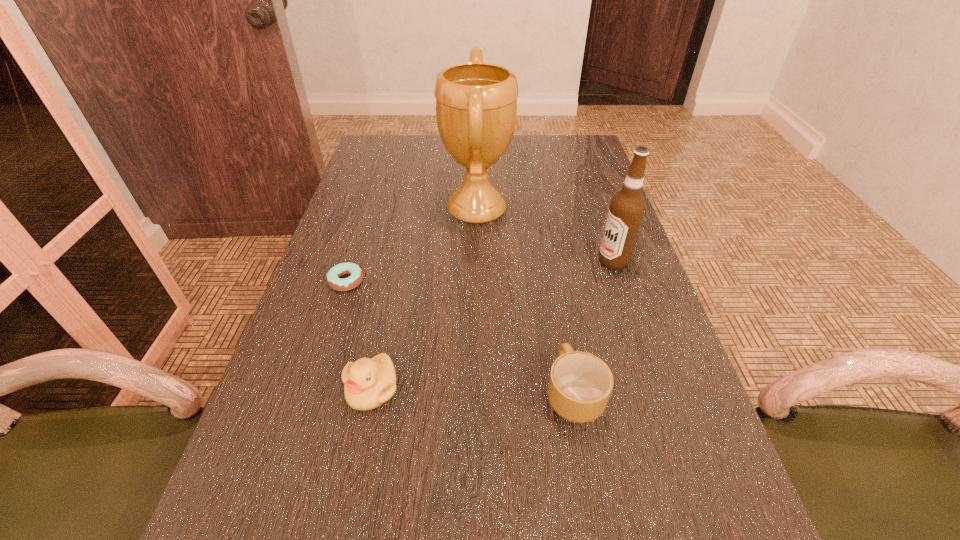
At what (x,y) coordinates should I click in order to perform the action: click on vacant area that lies between the alcohol and the tallest object. Please return your answer as a coordinate pair (x, y). The height and width of the screenshot is (540, 960). Looking at the image, I should click on (545, 235).

I want to click on free space between the duckling and the rightmost object, so click(492, 325).

This screenshot has height=540, width=960. Find the location of `free space that is in between the doughnut and the third object from left to right`. free space that is in between the doughnut and the third object from left to right is located at coordinates (412, 245).

You are a GUI agent. You are given a task and a screenshot of the screen. Output one action in this format:
    pyautogui.click(x=<x>, y=<y>)
    Task: Click on the free space between the tallest object and the doughnut
    
    Given the screenshot: What is the action you would take?
    pyautogui.click(x=412, y=245)

Identify the location of free space between the rightmost object and the second object from right to left. (593, 327).

Locate which object ranks third in proximity to the fourth object from right to left. Please provide its 2D coordinates. Your answer should be formatted as a tuple, i.e. [(x, y)], where the tuple contains the x and y coordinates of a point satisfying the conditions above.

[(476, 103)]

Point out which object is positioned as the second nearest to the second object from left to right. Please provide its 2D coordinates. Your answer should be formatted as a tuple, i.e. [(x, y)], where the tuple contains the x and y coordinates of a point satisfying the conditions above.

[(580, 385)]

The height and width of the screenshot is (540, 960). I want to click on free space that satisfies the following two spatial constraints: 1. on the front of the award with the decoration; 2. on the beak of the fourth object from right to left, so click(x=475, y=389).

Find the location of a particular element. The image size is (960, 540). vacant space that satisfies the following two spatial constraints: 1. on the front of the tallest object with the decoration; 2. on the side with the handle of the mug is located at coordinates (475, 394).

Locate an element on the screen. The width and height of the screenshot is (960, 540). free space in the image that satisfies the following two spatial constraints: 1. on the side with the handle of the second object from right to left; 2. on the front of the award with the decoration is located at coordinates (541, 210).